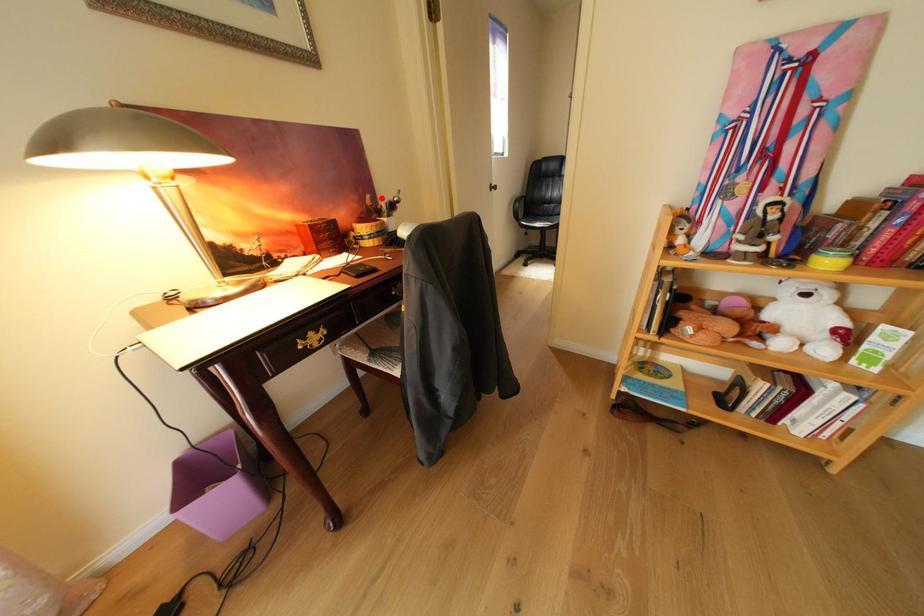
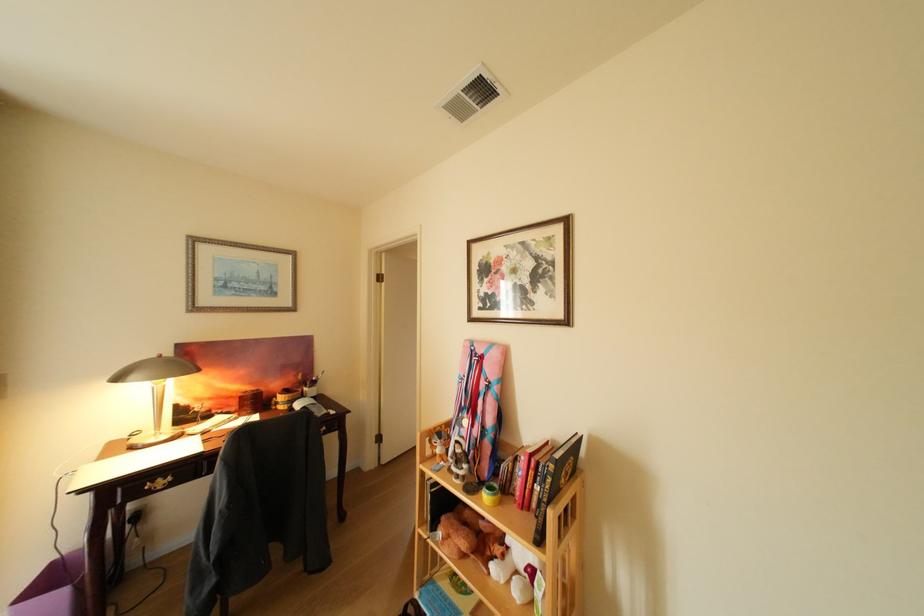
Find the pixel in the second image that matches the highlighted location in the first image.

(313, 376)